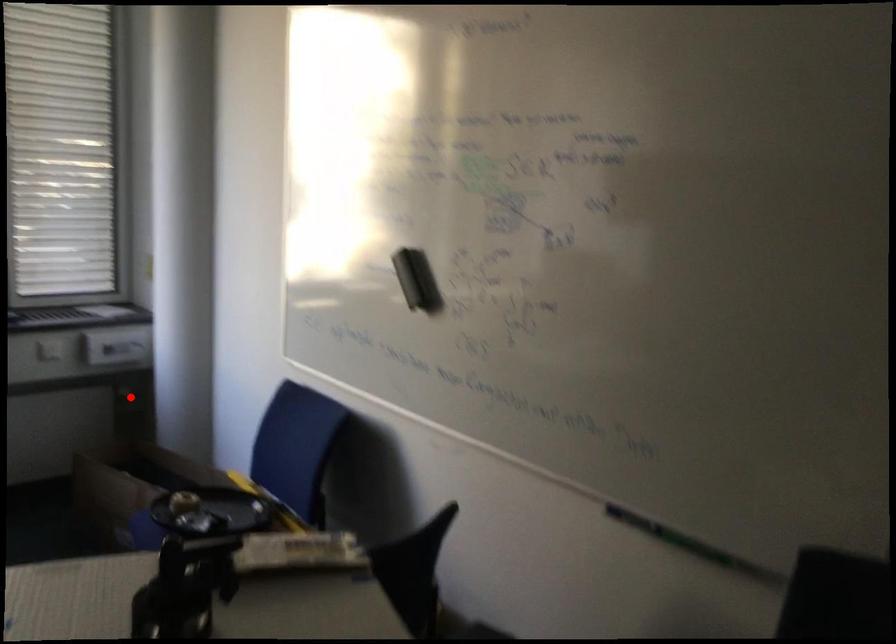
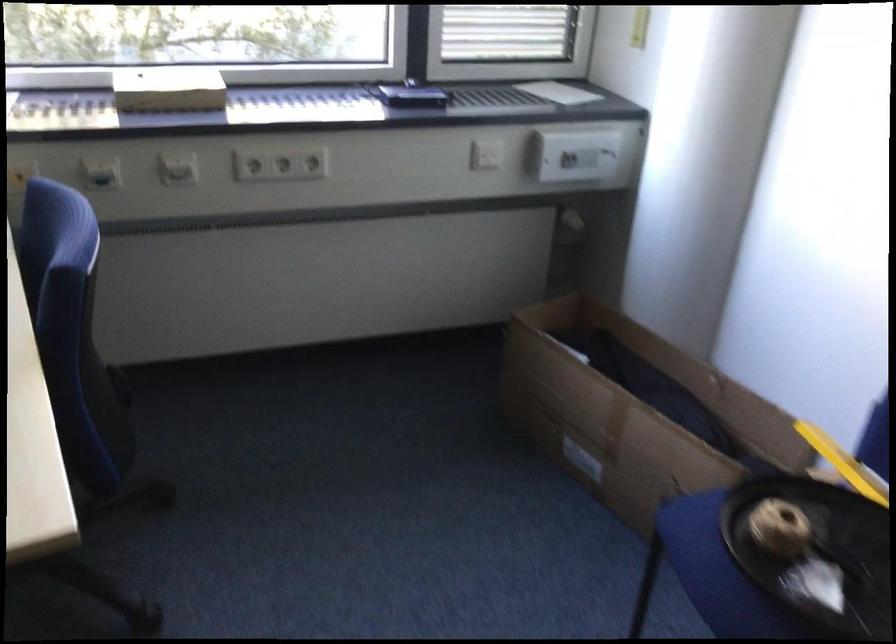
The point at the highlighted location is marked in the first image. Where is the corresponding point in the second image?

(570, 225)